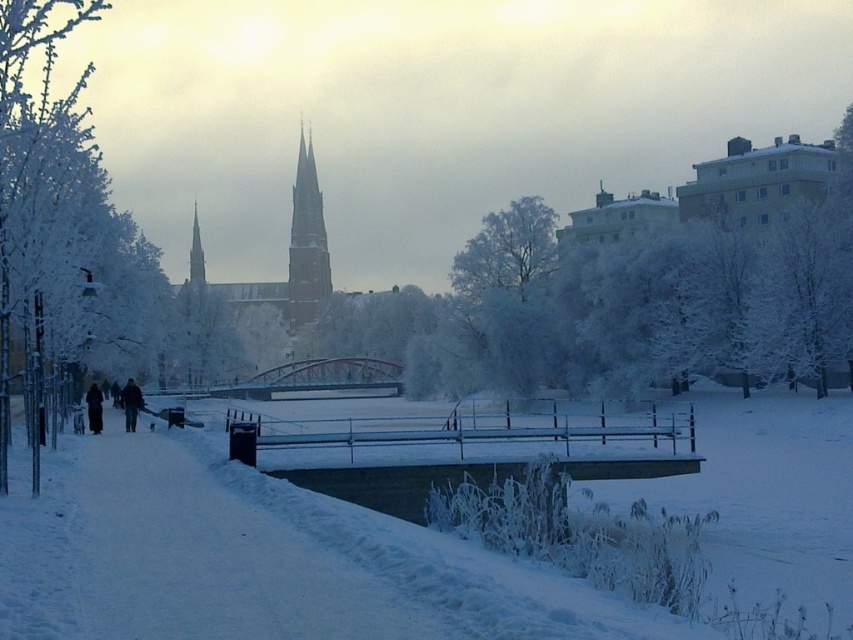
You are a hiker who wants to cross the metallic bridge at center without getting too close to the white frosty tree at center. What is the minimum distance you need to maintain between yourself and the tree to safely reach the bridge?

The white frosty tree at center and metallic bridge at center are 24.48 meters apart. To safely cross the metallic bridge at center while maintaining distance from the white frosty tree at center, you need to ensure you stay at least 24.48 meters away from the tree.

You are standing on the snow path and want to take a photo of the white frosty tree at center and the black matte coat at left. Which object should you zoom in more on to ensure both are in focus?

You should zoom in more on the white frosty tree at center because it is larger than the black matte coat at left, so it will require more focus to capture its details clearly.